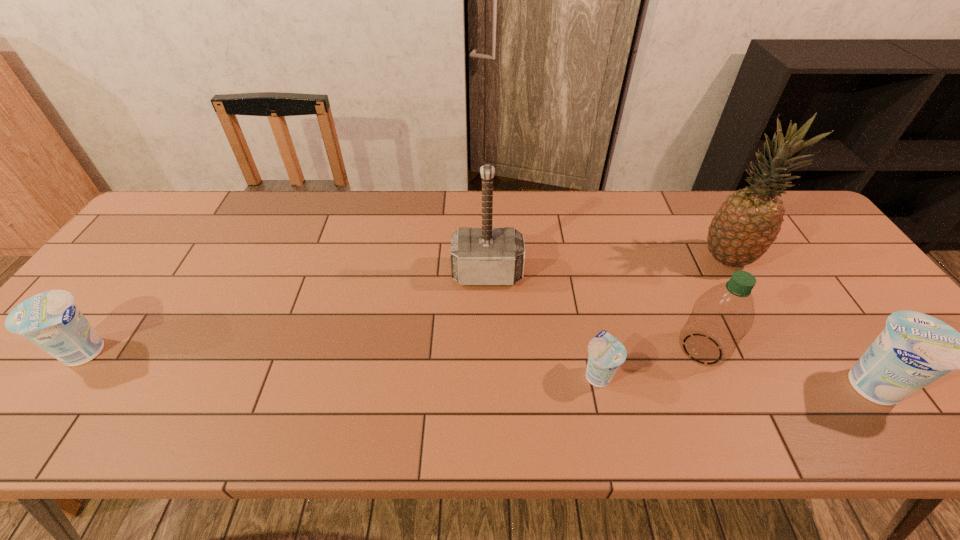
This screenshot has height=540, width=960. Find the location of `the leftmost object`. the leftmost object is located at coordinates (51, 320).

In order to click on the second shortest yogurt in this screenshot , I will do `click(51, 320)`.

Locate an element on the screen. The image size is (960, 540). the shortest object is located at coordinates (606, 353).

This screenshot has height=540, width=960. In order to click on the second yogurt from right to left in this screenshot , I will do `click(606, 353)`.

This screenshot has width=960, height=540. Find the location of `the rightmost yogurt`. the rightmost yogurt is located at coordinates coord(914,349).

You are a GUI agent. You are given a task and a screenshot of the screen. Output one action in this format:
    pyautogui.click(x=<x>, y=<y>)
    Task: Click on the fifth shortest object
    This screenshot has width=960, height=540.
    Given the screenshot: What is the action you would take?
    pyautogui.click(x=479, y=256)

Locate an element on the screen. This screenshot has height=540, width=960. hammer is located at coordinates (479, 256).

Where is `pineapple`? The image size is (960, 540). pineapple is located at coordinates (748, 222).

Image resolution: width=960 pixels, height=540 pixels. In order to click on the fourth shortest object in this screenshot , I will do 721,317.

Find the location of a particular element. The height and width of the screenshot is (540, 960). the fourth object from left to right is located at coordinates (721, 317).